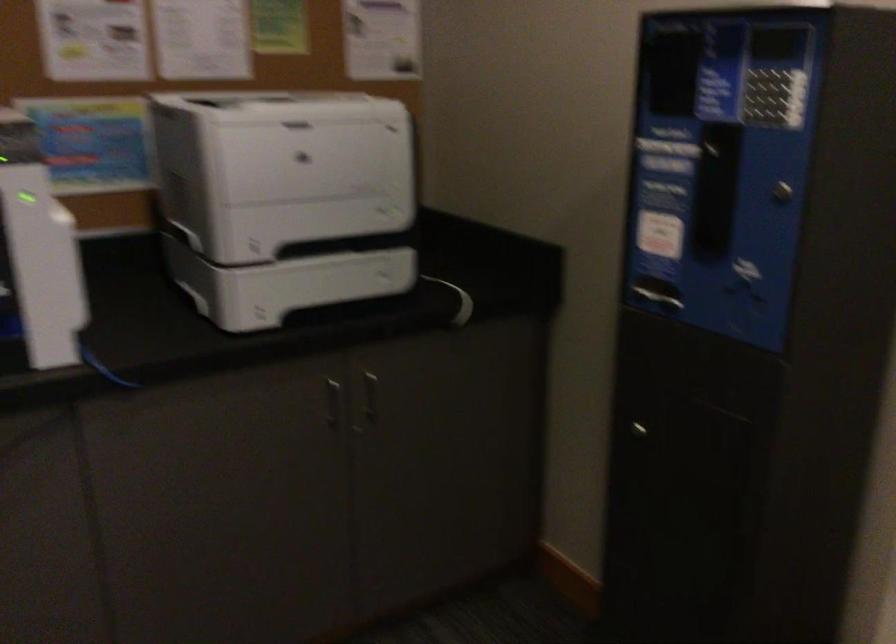
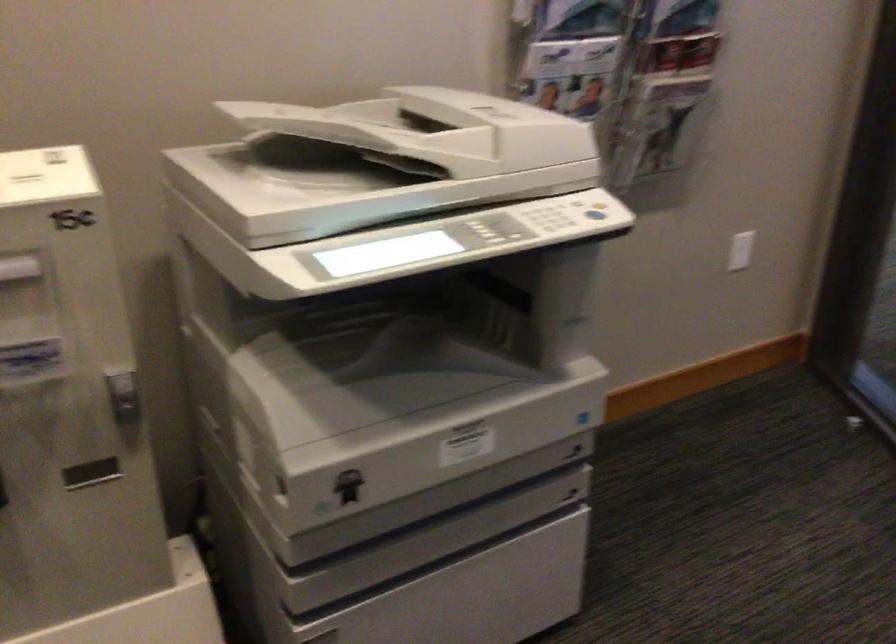
How did the camera likely rotate?

The camera rotated toward right-down.